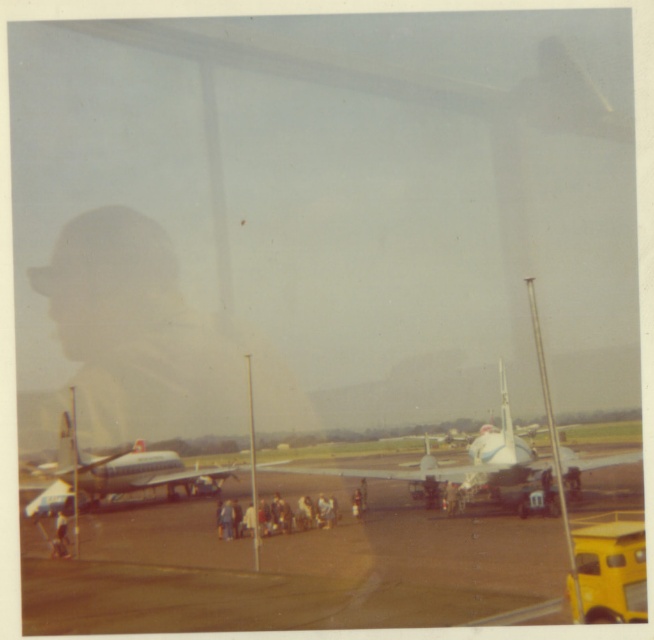
Question: Does smooth asphalt tarmac at center have a larger size compared to white glossy airplane at center?

Choices:
 (A) yes
 (B) no

Answer: (B)

Question: Considering the relative positions of smooth asphalt tarmac at center and silver metallic airplane at center in the image provided, where is smooth asphalt tarmac at center located with respect to silver metallic airplane at center?

Choices:
 (A) right
 (B) left

Answer: (A)

Question: Which object appears closest to the camera in this image?

Choices:
 (A) light beige fabric person at lower left
 (B) white glossy airplane at center

Answer: (B)

Question: Which of the following is the closest to the observer?

Choices:
 (A) light brown leather jacket at center
 (B) smooth asphalt tarmac at center
 (C) silver metallic airplane at center

Answer: (B)

Question: From the image, what is the correct spatial relationship of white glossy airplane at center in relation to light brown leather jacket at center?

Choices:
 (A) right
 (B) left

Answer: (A)

Question: Which point appears closest to the camera in this image?

Choices:
 (A) (60, 442)
 (B) (33, 570)

Answer: (B)